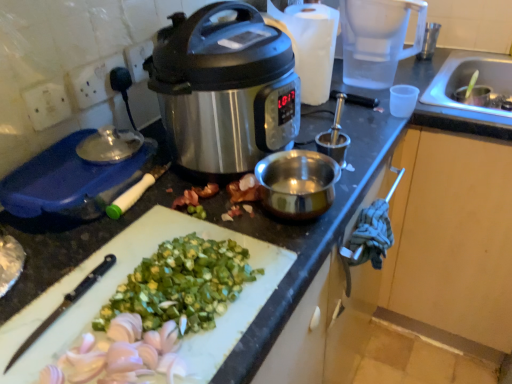
Image resolution: width=512 pixels, height=384 pixels. In order to click on blue plastic container at left in this screenshot , I will do `click(67, 185)`.

In the scene shown: Measure the distance between point [75,323] and camera.

Point [75,323] and camera are 22.87 inches apart.

Based on the photo, what is the approximate height of metallic silver cup at upper right?

metallic silver cup at upper right is 4.81 inches in height.

Image resolution: width=512 pixels, height=384 pixels. What are the coordinates of `stainless steel slow cooker at center` in the screenshot? It's located at (225, 89).

This screenshot has height=384, width=512. Describe the element at coordinates (241, 194) in the screenshot. I see `green matte okra at center` at that location.

Where is `blue plastic container at left`? The width and height of the screenshot is (512, 384). blue plastic container at left is located at coordinates (67, 185).

Can metallic silver cup at upper right be found inside stainless steel slow cooker at center?

No, metallic silver cup at upper right is not surrounded by stainless steel slow cooker at center.

Which of these two, stainless steel slow cooker at center or metallic silver cup at upper right, is bigger?

With larger size is stainless steel slow cooker at center.

Based on the photo, considering the sizes of objects stainless steel slow cooker at center and metallic silver cup at upper right in the image provided, who is thinner, stainless steel slow cooker at center or metallic silver cup at upper right?

With smaller width is metallic silver cup at upper right.

Is stainless steel slow cooker at center not near metallic silver cup at upper right?

stainless steel slow cooker at center is near metallic silver cup at upper right, not far away.

Based on the photo, is metallic silver cup at upper right turned away from transparent plastic blender at upper right?

metallic silver cup at upper right is not turned away from transparent plastic blender at upper right.

Is transparent plastic blender at upper right surrounded by metallic silver cup at upper right?

Actually, transparent plastic blender at upper right is outside metallic silver cup at upper right.

Are metallic silver cup at upper right and transparent plastic blender at upper right making contact?

metallic silver cup at upper right and transparent plastic blender at upper right are clearly separated.

Does metallic silver cup at upper right have a lesser width compared to transparent plastic blender at upper right?

Correct, the width of metallic silver cup at upper right is less than that of transparent plastic blender at upper right.

Considering the sizes of objects white plastic cutting board at lower center and transparent plastic blender at upper right in the image provided, who is shorter, white plastic cutting board at lower center or transparent plastic blender at upper right?

Standing shorter between the two is white plastic cutting board at lower center.

Measure the distance between white plastic cutting board at lower center and transparent plastic blender at upper right.

They are 82.35 centimeters apart.

Is white plastic cutting board at lower center to the left of transparent plastic blender at upper right from the viewer's perspective?

Indeed, white plastic cutting board at lower center is positioned on the left side of transparent plastic blender at upper right.

Looking at this image, is white plastic cutting board at lower center next to transparent plastic blender at upper right and touching it?

white plastic cutting board at lower center and transparent plastic blender at upper right are not in contact.

From the image's perspective, is transparent plastic blender at upper right positioned above or below metallic silver cup at upper right?

From the image's perspective, transparent plastic blender at upper right appears below metallic silver cup at upper right.

Is transparent plastic blender at upper right in front of or behind metallic silver cup at upper right in the image?

transparent plastic blender at upper right is positioned closer to the viewer than metallic silver cup at upper right.

The height and width of the screenshot is (384, 512). I want to click on blender to the left of metallic silver cup at upper right, so click(377, 39).

Identify the location of appliance on the right of the green matte okra at center. (429, 41).

Is green matte okra at center looking in the opposite direction of metallic silver cup at upper right?

No, green matte okra at center is not facing the opposite direction of metallic silver cup at upper right.

Which of these two, green matte okra at center or metallic silver cup at upper right, is bigger?

With larger size is metallic silver cup at upper right.

Is metallic silver cup at upper right located within green matte okra at center?

That's incorrect, metallic silver cup at upper right is not inside green matte okra at center.

Is stainless steel slow cooker at center touching white plastic cutting board at lower center?

stainless steel slow cooker at center and white plastic cutting board at lower center are clearly separated.

Is stainless steel slow cooker at center positioned in front of white plastic cutting board at lower center?

No, stainless steel slow cooker at center is further to the viewer.

Considering the sizes of objects stainless steel slow cooker at center and white plastic cutting board at lower center in the image provided, who is wider, stainless steel slow cooker at center or white plastic cutting board at lower center?

stainless steel slow cooker at center is wider.

Measure the distance from stainless steel slow cooker at center to white plastic cutting board at lower center.

The distance of stainless steel slow cooker at center from white plastic cutting board at lower center is 10.48 inches.

Is transparent plastic blender at upper right far away from blue plastic container at left?

No, transparent plastic blender at upper right is not far from blue plastic container at left.

Locate an element on the screen. The image size is (512, 384). blender behind the blue plastic container at left is located at coordinates point(377,39).

From the picture: Which object is more forward, transparent plastic blender at upper right or blue plastic container at left?

Positioned in front is blue plastic container at left.

Where is `slow cooker above the metallic silver cup at upper right (from a real-world perspective)`? slow cooker above the metallic silver cup at upper right (from a real-world perspective) is located at coordinates 225,89.

Locate an element on the screen. Image resolution: width=512 pixels, height=384 pixels. appliance behind the transparent plastic blender at upper right is located at coordinates (429, 41).

Based on their spatial positions, is white plastic cutting board at lower center or transparent plastic blender at upper right closer to stainless steel slow cooker at center?

white plastic cutting board at lower center.

Estimate the real-world distances between objects in this image. Which object is further from transparent plastic blender at upper right, green matte okra at center or white plastic cutting board at lower center?

The object further to transparent plastic blender at upper right is white plastic cutting board at lower center.

From the image, which object appears to be farther from metallic silver cup at upper right, white plastic cutting board at lower center or green matte okra at center?

white plastic cutting board at lower center is positioned further to the anchor metallic silver cup at upper right.

Estimate the real-world distances between objects in this image. Which object is closer to stainless steel slow cooker at center, metallic silver cup at upper right or blue plastic container at left?

Among the two, blue plastic container at left is located nearer to stainless steel slow cooker at center.

When comparing their distances from white plastic cutting board at lower center, does green matte okra at center or metallic silver cup at upper right seem further?

metallic silver cup at upper right.

Which object lies further to the anchor point blue plastic container at left, transparent plastic blender at upper right or green matte okra at center?

The object further to blue plastic container at left is transparent plastic blender at upper right.

Considering their positions, is green matte okra at center positioned further to white plastic cutting board at lower center than transparent plastic blender at upper right?

The object further to white plastic cutting board at lower center is transparent plastic blender at upper right.

From the image, which object appears to be nearer to metallic silver cup at upper right, white plastic cutting board at lower center or stainless steel slow cooker at center?

The object closer to metallic silver cup at upper right is stainless steel slow cooker at center.

Locate an element on the screen. The image size is (512, 384). produce between stainless steel slow cooker at center and metallic silver cup at upper right in the front-back direction is located at coordinates (241, 194).

Locate an element on the screen. produce situated between blue plastic container at left and stainless steel slow cooker at center from left to right is located at coordinates (241, 194).

This screenshot has height=384, width=512. Identify the location of kitchen appliance between white plastic cutting board at lower center and green matte okra at center along the z-axis. (67, 185).

The width and height of the screenshot is (512, 384). Find the location of `kitchen appliance between white plastic cutting board at lower center and metallic silver cup at upper right along the z-axis`. kitchen appliance between white plastic cutting board at lower center and metallic silver cup at upper right along the z-axis is located at coordinates (67, 185).